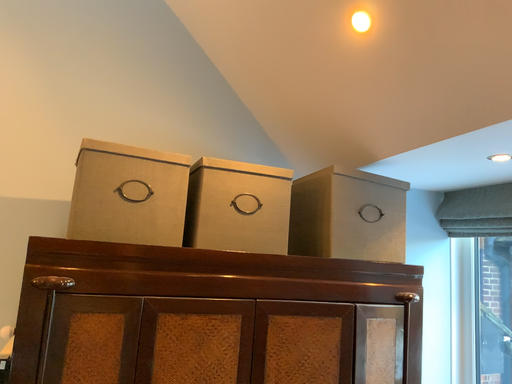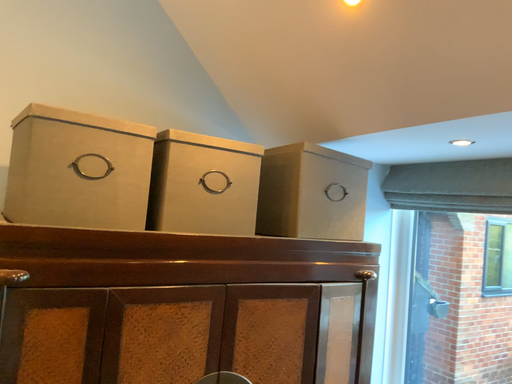
Question: How did the camera likely rotate when shooting the video?

Choices:
 (A) rotated downward
 (B) rotated upward

Answer: (A)